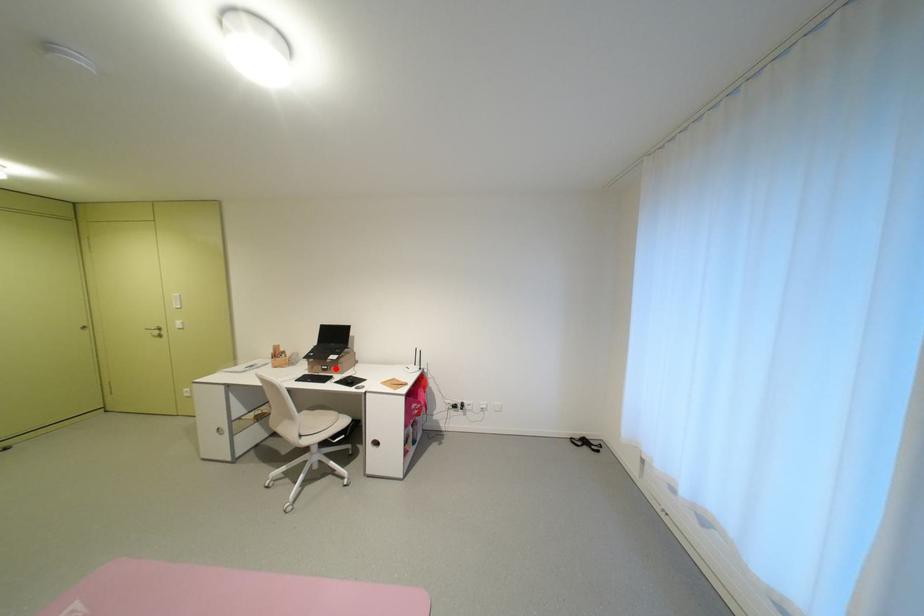
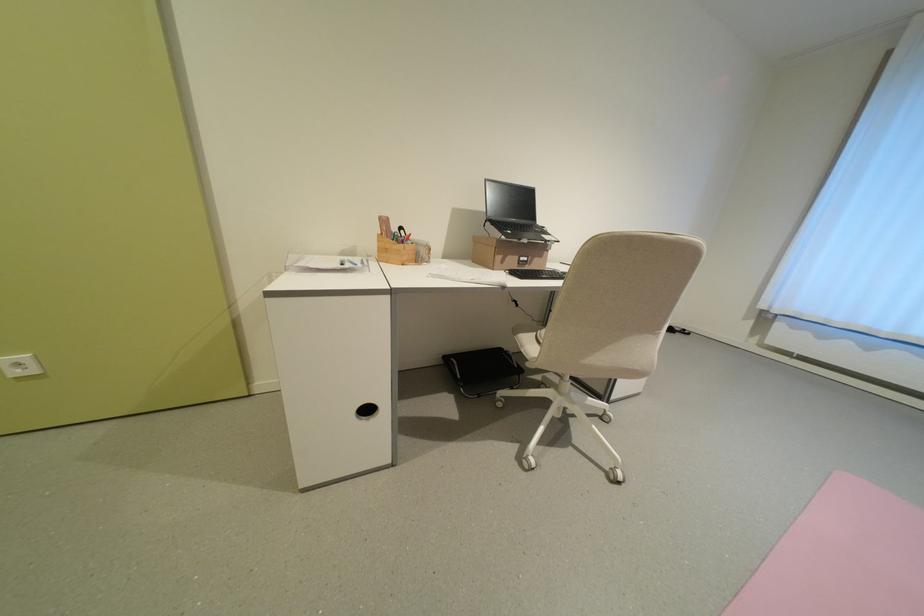
Question: I am providing you with two images of the same scene from different viewpoints. A red point is marked on the first image. At the location where the point appears in image 1, is it still visible in image 2?

Choices:
 (A) Yes
 (B) No

Answer: (A)